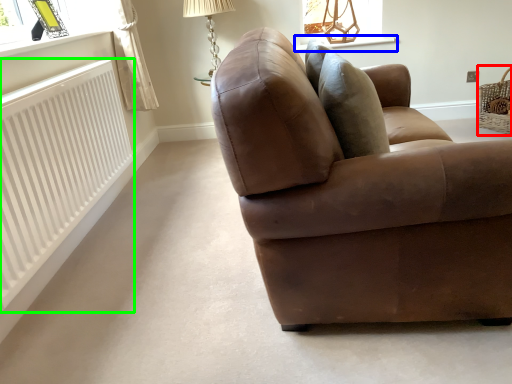
Question: Which object is the closest to the basket (highlighted by a red box)? Choose among these: window sill (highlighted by a blue box) or radiator (highlighted by a green box).

Choices:
 (A) window sill
 (B) radiator

Answer: (A)